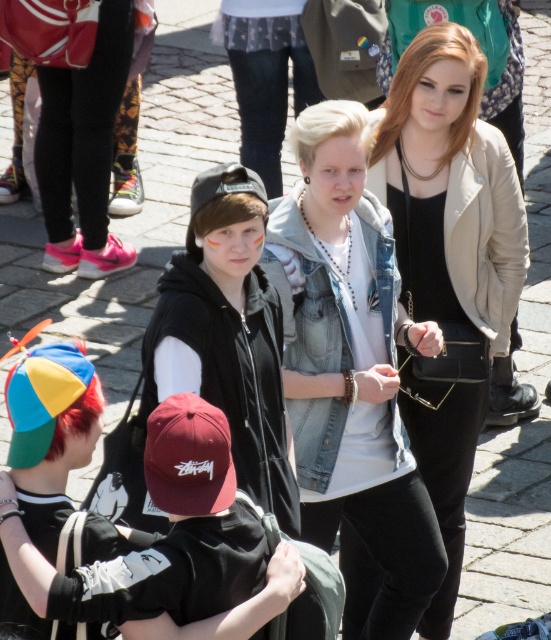
You are a tailor who needs to determine which garment requires more fabric for a similar design. Based on the image, which item is wider between the denim jacket at center and the black matte hoodie at center?

The denim jacket at center is wider than the black matte hoodie at center, so it would require more fabric for a similar design.

You are organizing a charity event and need to display two items from the image. The black matte hoodie at center and the matte black cap at center must be placed on a shelf. The shelf has limited space, and you want to arrange them so that the larger item is at the back to avoid blocking the smaller one. Based on the scene description, which item should be placed at the back?

The black matte hoodie at center should be placed at the back because it has a larger size compared to the matte black cap at center, ensuring the smaller cap remains visible.

From the picture: You are a photographer trying to capture a candid shot of the person in the denim jacket at center without including the black matte hoodie at center in the frame. Is this possible based on their positions?

The black matte hoodie at center is behind the denim jacket at center, so you can position the camera to focus on the denim jacket at center while excluding the black matte hoodie at center from the shot.